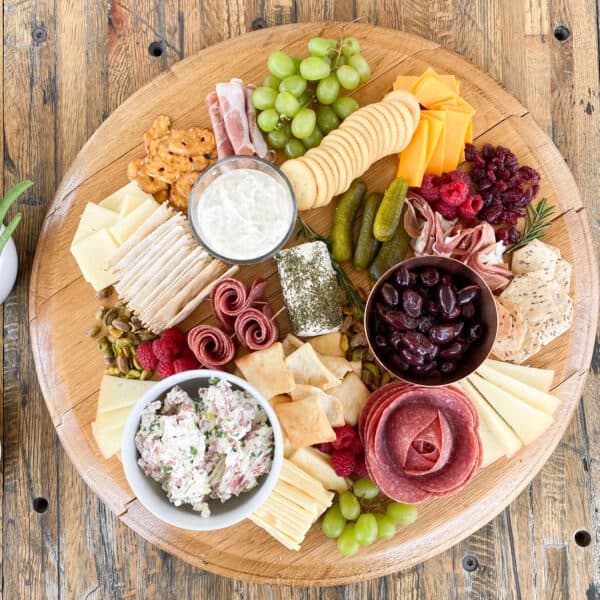
Locate an element on the screen. glass bowl is located at coordinates (230, 162), (254, 258).